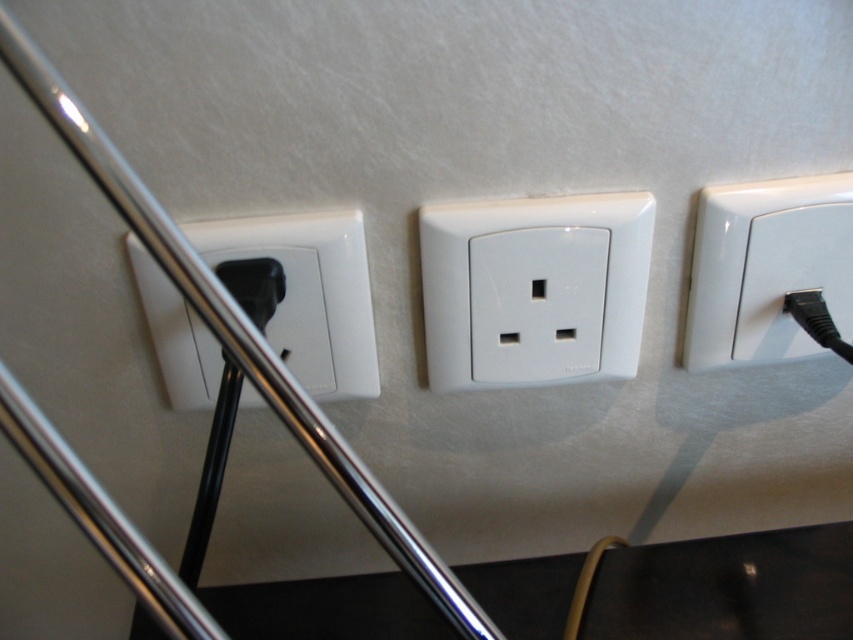
Does white plastic outlet at left appear on the left side of white glossy electrical outlet at upper right?

Indeed, white plastic outlet at left is positioned on the left side of white glossy electrical outlet at upper right.

Is point (181, 227) positioned behind point (761, 243)?

No, (181, 227) is closer to viewer.

Between point (328, 305) and point (763, 332), which one is positioned behind?

Point (763, 332)

You are a GUI agent. You are given a task and a screenshot of the screen. Output one action in this format:
    pyautogui.click(x=<x>, y=<y>)
    Task: Click on the white plastic outlet at left
    
    Given the screenshot: What is the action you would take?
    pyautogui.click(x=309, y=292)

Between point (492, 321) and point (831, 177), which one is positioned behind?

Positioned behind is point (492, 321).

The width and height of the screenshot is (853, 640). Find the location of `white glossy electrical outlet at center`. white glossy electrical outlet at center is located at coordinates (534, 289).

This screenshot has height=640, width=853. What are the coordinates of `white glossy electrical outlet at center` in the screenshot? It's located at (534, 289).

Between white glossy electrical outlet at center and white plastic outlet at left, which one is positioned higher?

Positioned higher is white glossy electrical outlet at center.

Is the position of white glossy electrical outlet at center more distant than that of white plastic outlet at left?

Yes, it is behind white plastic outlet at left.

This screenshot has height=640, width=853. I want to click on white glossy electrical outlet at center, so click(534, 289).